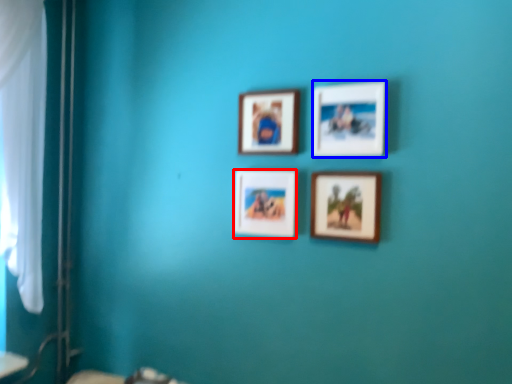
Question: Among these objects, which one is nearest to the camera, picture frame (highlighted by a red box) or picture frame (highlighted by a blue box)?

Choices:
 (A) picture frame
 (B) picture frame

Answer: (B)